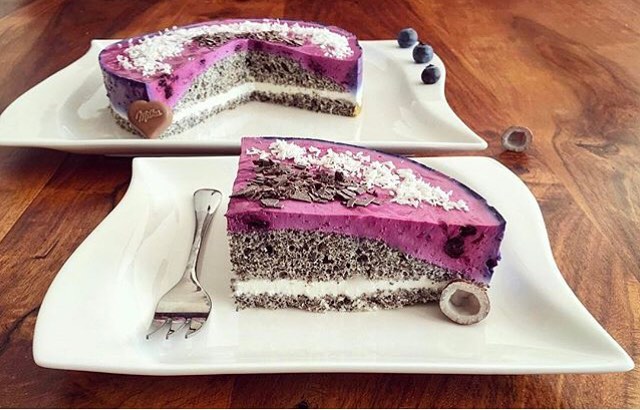
Find the location of a particular element. The image size is (640, 410). plate is located at coordinates (11, 129), (262, 335).